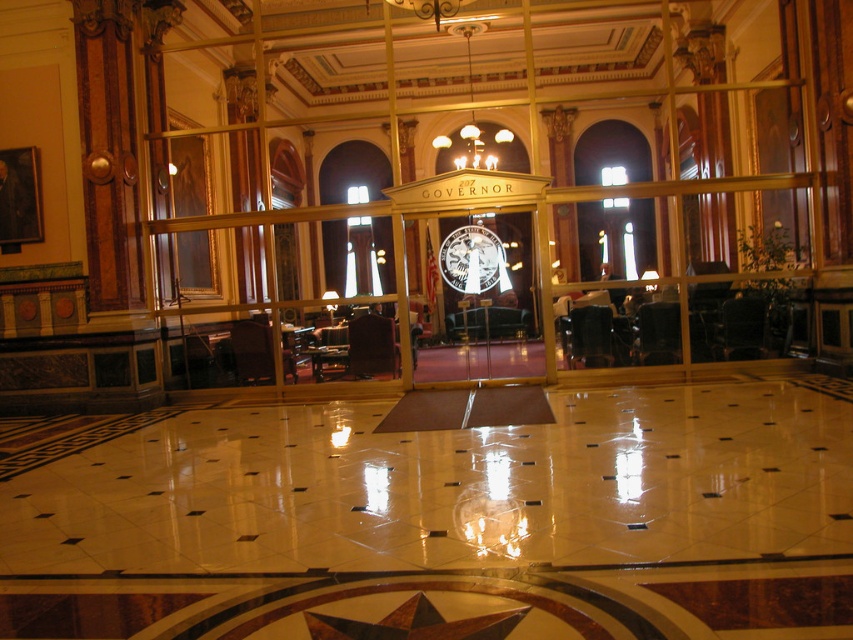
Question: Is wooden star at center positioned in front of gold metallic chandelier at upper center?

Choices:
 (A) no
 (B) yes

Answer: (B)

Question: Can you confirm if wooden star at center is thinner than metallic silver clock at center?

Choices:
 (A) yes
 (B) no

Answer: (B)

Question: Which point is closer to the camera taking this photo?

Choices:
 (A) (476, 250)
 (B) (369, 621)

Answer: (B)

Question: Which object appears closest to the camera in this image?

Choices:
 (A) gold metallic chandelier at upper center
 (B) metallic silver clock at center

Answer: (B)

Question: Which point is closer to the camera?

Choices:
 (A) (491, 156)
 (B) (469, 236)
 (C) (456, 625)

Answer: (C)

Question: Can you confirm if wooden star at center is bigger than gold metallic chandelier at upper center?

Choices:
 (A) no
 (B) yes

Answer: (A)